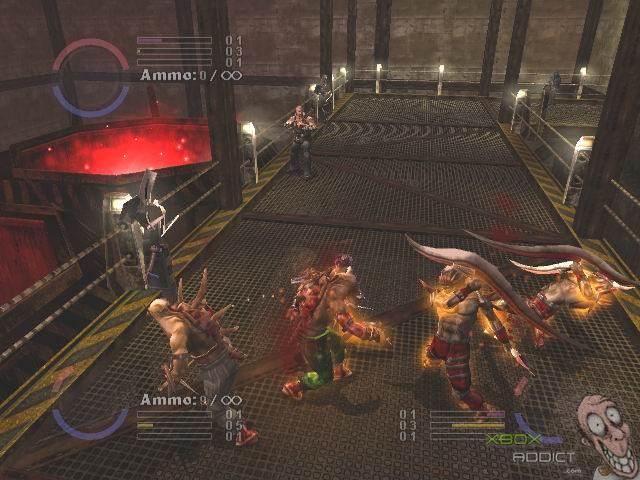
At what (x,y) coordinates should I click in order to perform the action: click on back gray wall. Please return your answer as a coordinate pair (x, y). This screenshot has height=480, width=640. Looking at the image, I should click on (445, 27).